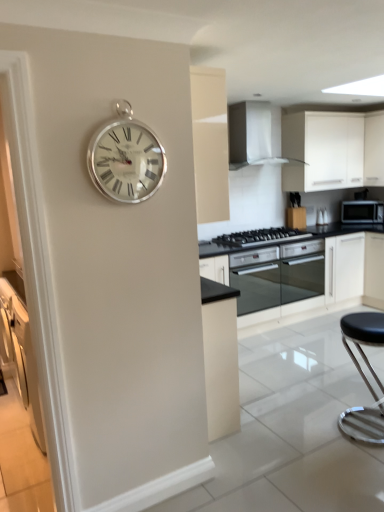
Question: Is white glossy range hood at upper center completely or partially outside of silver metallic clock at upper left?

Choices:
 (A) no
 (B) yes

Answer: (B)

Question: Is white glossy range hood at upper center at the left side of silver metallic clock at upper left?

Choices:
 (A) no
 (B) yes

Answer: (A)

Question: From a real-world perspective, is white glossy range hood at upper center under silver metallic clock at upper left?

Choices:
 (A) yes
 (B) no

Answer: (B)

Question: Considering the relative sizes of white glossy range hood at upper center and silver metallic clock at upper left in the image provided, is white glossy range hood at upper center smaller than silver metallic clock at upper left?

Choices:
 (A) yes
 (B) no

Answer: (B)

Question: Could you tell me if white glossy range hood at upper center is turned towards silver metallic clock at upper left?

Choices:
 (A) yes
 (B) no

Answer: (B)

Question: Is silver metallic clock at upper left completely or partially inside white glossy range hood at upper center?

Choices:
 (A) yes
 (B) no

Answer: (B)

Question: Is black leather stool at lower right further to camera compared to black glass oven at center, placed as the first oven when sorted from left to right?

Choices:
 (A) yes
 (B) no

Answer: (B)

Question: Is black leather stool at lower right oriented towards black glass oven at center, the second oven viewed from the right?

Choices:
 (A) yes
 (B) no

Answer: (B)

Question: Is there a large distance between black leather stool at lower right and black glass oven at center, placed as the first oven when sorted from left to right?

Choices:
 (A) yes
 (B) no

Answer: (A)

Question: From a real-world perspective, does black leather stool at lower right sit lower than black glass oven at center, placed as the first oven when sorted from left to right?

Choices:
 (A) yes
 (B) no

Answer: (A)

Question: Can you confirm if black leather stool at lower right is thinner than black glass oven at center, placed as the first oven when sorted from left to right?

Choices:
 (A) yes
 (B) no

Answer: (A)

Question: Is black leather stool at lower right next to black glass oven at center, placed as the first oven when sorted from left to right, and touching it?

Choices:
 (A) no
 (B) yes

Answer: (A)

Question: From a real-world perspective, is white matte cabinet at upper right under black glass oven at center, acting as the 1th oven starting from the right?

Choices:
 (A) yes
 (B) no

Answer: (B)